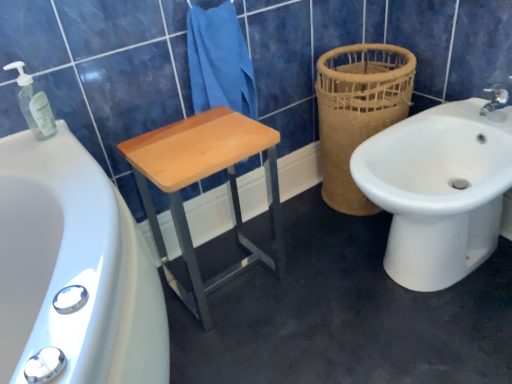
Locate an element on the screen. vacant space underneath white ceramic bidet at right (from a real-world perspective) is located at coordinates (414, 283).